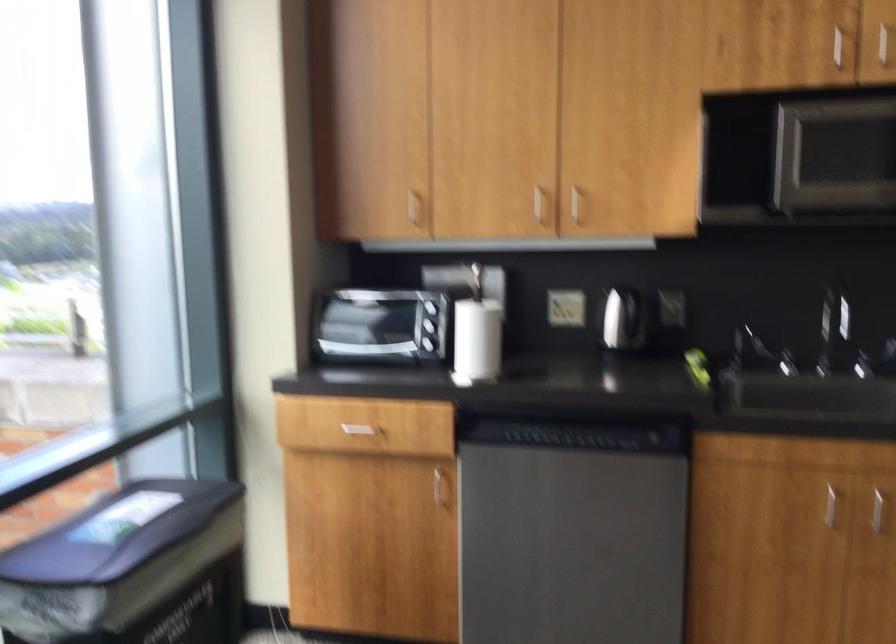
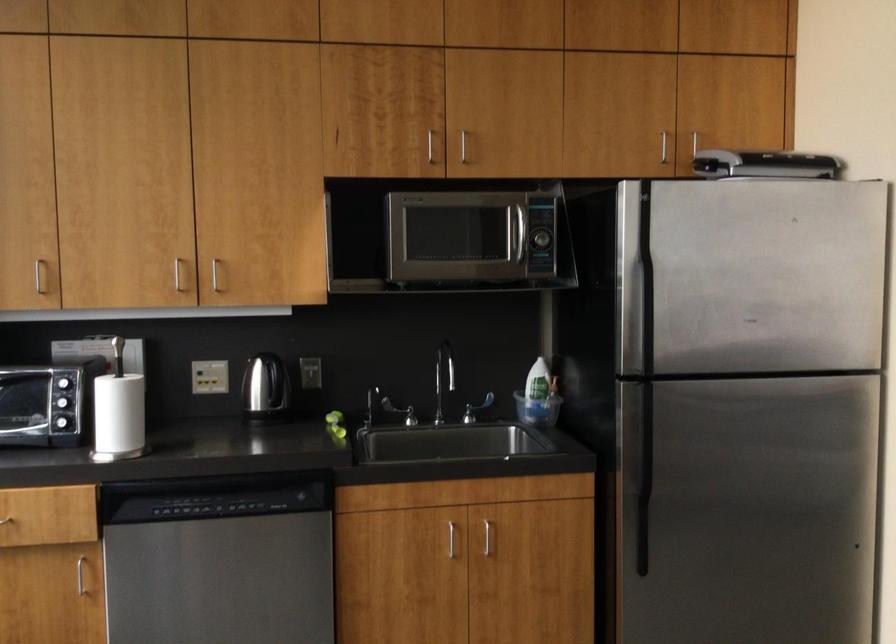
Where in the second image is the point corresponding to (x=470, y=341) from the first image?

(117, 415)